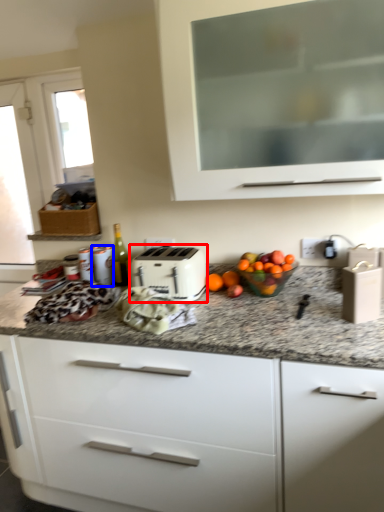
Question: Which object is closer to the camera taking this photo, toaster (highlighted by a red box) or appliance (highlighted by a blue box)?

Choices:
 (A) toaster
 (B) appliance

Answer: (A)